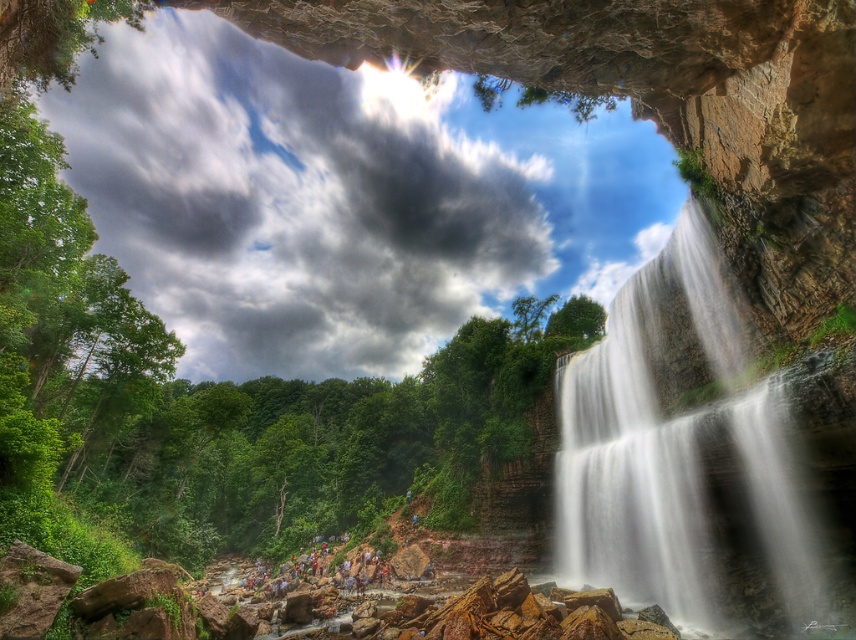
Question: Observing the image, what is the correct spatial positioning of white textured water at right in reference to multicolored clothing at center?

Choices:
 (A) left
 (B) right

Answer: (B)

Question: Is white textured water at right below multicolored clothing at center?

Choices:
 (A) no
 (B) yes

Answer: (A)

Question: Which point is farther to the camera?

Choices:
 (A) (268, 580)
 (B) (722, 316)

Answer: (A)

Question: Is white textured water at right further to the viewer compared to multicolored clothing at center?

Choices:
 (A) no
 (B) yes

Answer: (A)